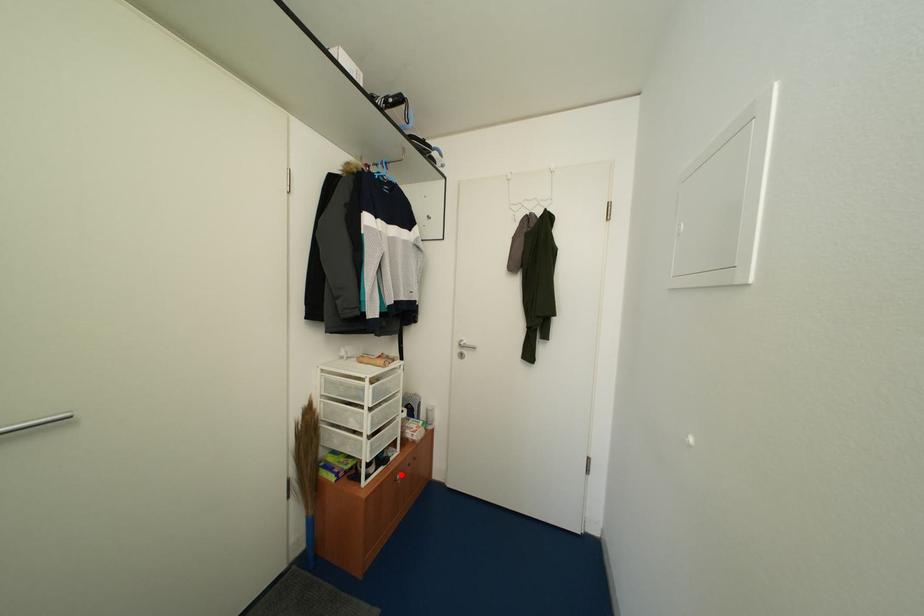
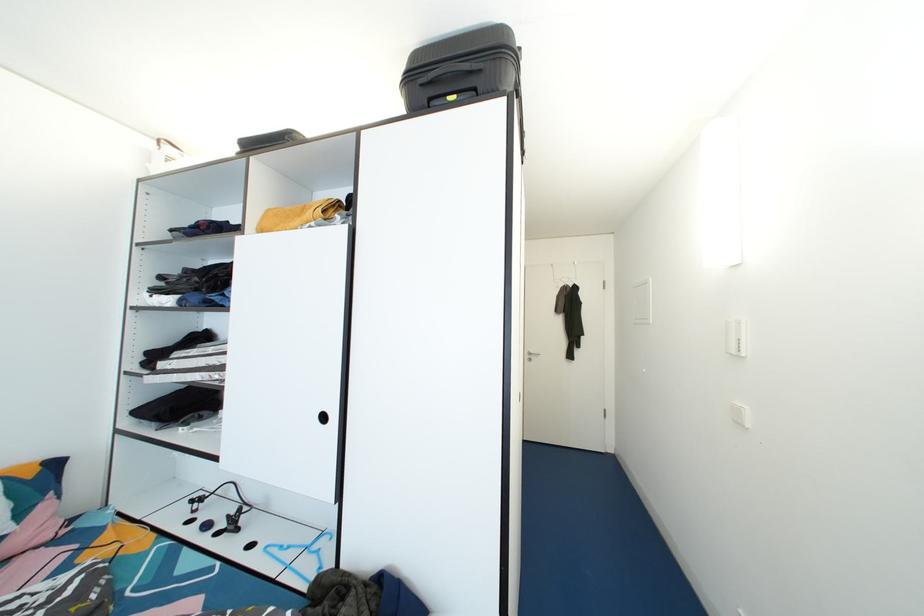
Question: I am providing you with two images of the same scene from different viewpoints. A red point is marked on the first image. Is the red point's position out of view in image 2?

Choices:
 (A) Yes
 (B) No

Answer: (A)